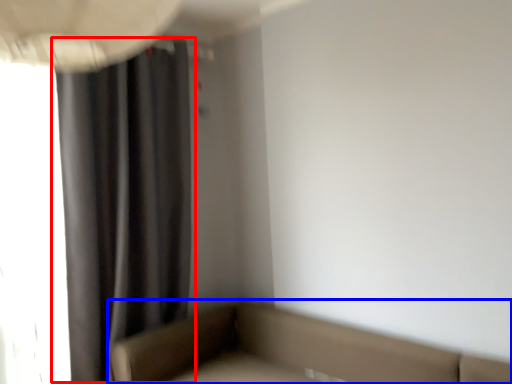
Question: Which of the following is the closest to the observer, curtain (highlighted by a red box) or studio couch (highlighted by a blue box)?

Choices:
 (A) curtain
 (B) studio couch

Answer: (B)